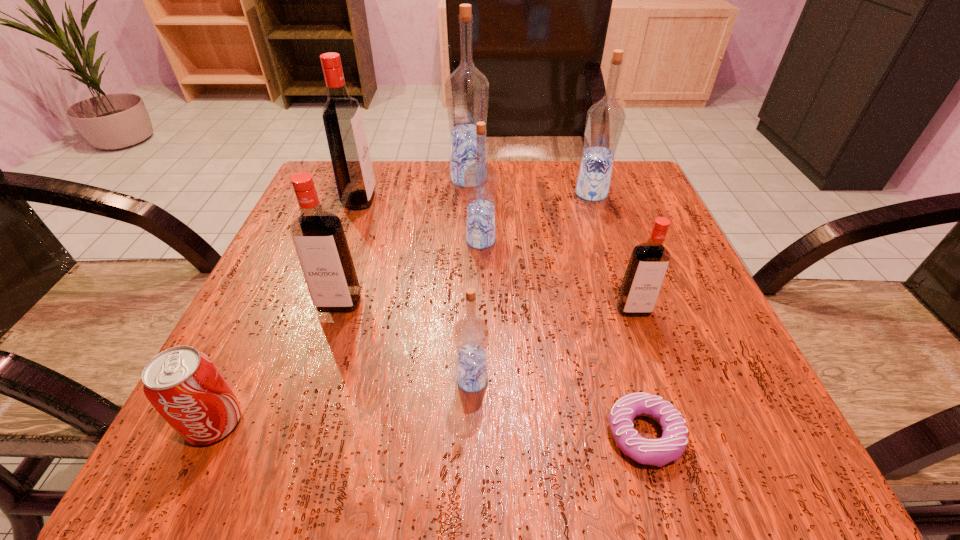
Where is `free point located 0.110m on the left of the third nearest object`? free point located 0.110m on the left of the third nearest object is located at coordinates (380, 380).

In order to click on vacant space located 0.170m on the right of the soda in this screenshot , I will do `click(372, 423)`.

This screenshot has height=540, width=960. Find the location of `vacant position located on the back of the doughnut`. vacant position located on the back of the doughnut is located at coordinates (586, 231).

What are the coordinates of `soda that is at the near edge` in the screenshot? It's located at (184, 385).

Where is `doughnut situated at the near edge`? This screenshot has height=540, width=960. doughnut situated at the near edge is located at coordinates (658, 452).

Locate an element on the screen. soda that is at the left edge is located at coordinates (184, 385).

You are a GUI agent. You are given a task and a screenshot of the screen. Output one action in this format:
    pyautogui.click(x=<x>, y=<y>)
    Task: Click on the doughnut that is positioned at the right edge
    Image resolution: width=960 pixels, height=540 pixels.
    Given the screenshot: What is the action you would take?
    pyautogui.click(x=658, y=452)

You are a GUI agent. You are given a task and a screenshot of the screen. Output one action in this format:
    pyautogui.click(x=<x>, y=<y>)
    Task: Click on the object positioned at the far left corner
    This screenshot has height=540, width=960.
    Given the screenshot: What is the action you would take?
    pyautogui.click(x=345, y=133)

You are a GUI agent. You are given a task and a screenshot of the screen. Output one action in this format:
    pyautogui.click(x=<x>, y=<y>)
    Task: Click on the object that is at the near left corner
    
    Given the screenshot: What is the action you would take?
    pyautogui.click(x=184, y=385)

Locate an element on the screen. Image resolution: width=960 pixels, height=540 pixels. object located at the far right corner is located at coordinates (605, 120).